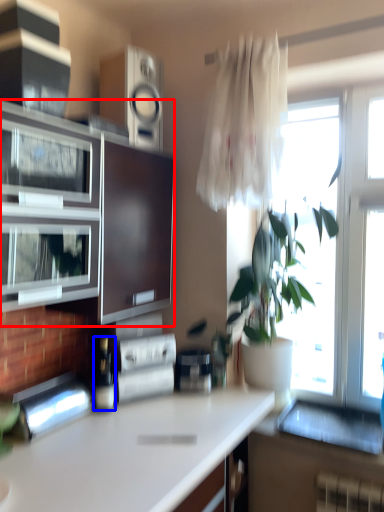
Question: Which object is closer to the camera taking this photo, cabinetry (highlighted by a red box) or bottle (highlighted by a blue box)?

Choices:
 (A) cabinetry
 (B) bottle

Answer: (A)